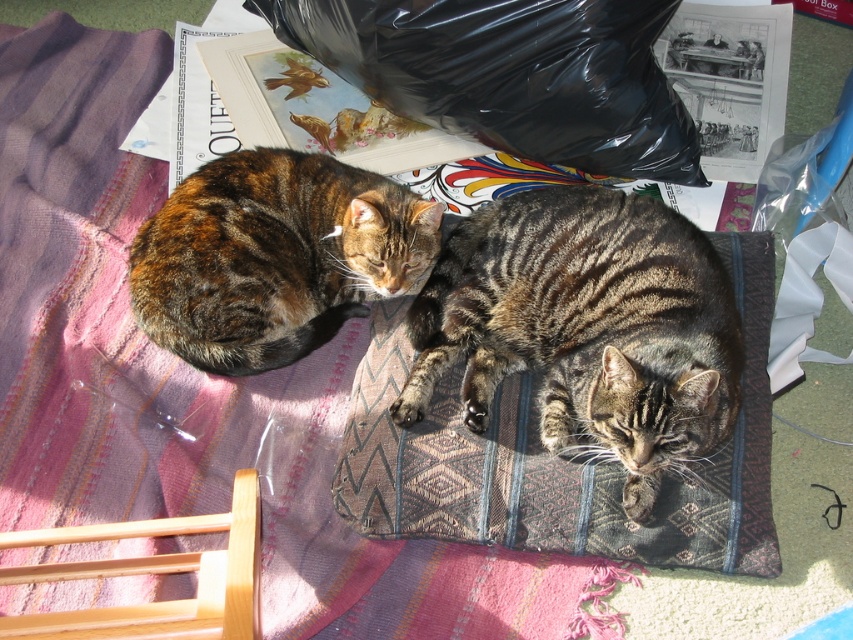
Between point (16, 468) and point (434, 228), which one is positioned behind?

Point (434, 228)

Is point (132, 326) positioned before point (219, 326)?

No, it is behind (219, 326).

You are a GUI agent. You are given a task and a screenshot of the screen. Output one action in this format:
    pyautogui.click(x=<x>, y=<y>)
    Task: Click on the pink woven blanket at upper left
    This screenshot has width=853, height=640.
    Given the screenshot: What is the action you would take?
    pyautogui.click(x=200, y=385)

Is pink woven blanket at upper left further to the viewer compared to tabby fur cat at center?

That is True.

Does pink woven blanket at upper left have a smaller size compared to tabby fur cat at center?

Incorrect, pink woven blanket at upper left is not smaller in size than tabby fur cat at center.

Is point (25, 436) farther from viewer compared to point (480, 422)?

Yes, it is behind point (480, 422).

In order to click on pink woven blanket at upper left in this screenshot , I will do `click(200, 385)`.

Which is more to the left, black plastic bag at upper center or tabby fur cat at left?

tabby fur cat at left

Can you confirm if black plastic bag at upper center is thinner than tabby fur cat at left?

In fact, black plastic bag at upper center might be wider than tabby fur cat at left.

Locate an element on the screen. The width and height of the screenshot is (853, 640). black plastic bag at upper center is located at coordinates (511, 74).

This screenshot has height=640, width=853. What are the coordinates of `black plastic bag at upper center` in the screenshot? It's located at (511, 74).